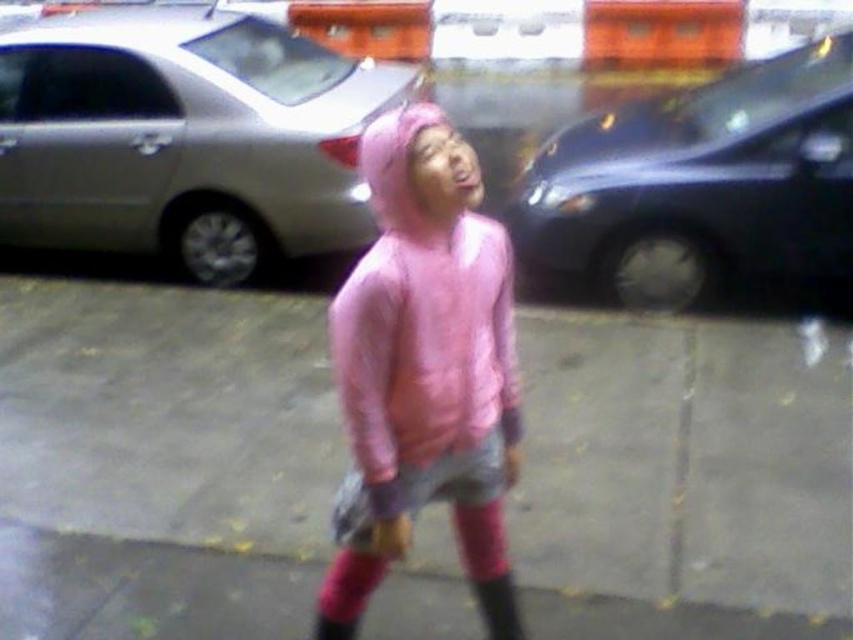
Question: Is the position of silver metallic sedan at center more distant than that of pink rubber rain boot at center?

Choices:
 (A) yes
 (B) no

Answer: (A)

Question: Does shiny black car at right have a smaller size compared to pink rubber rain boot at center?

Choices:
 (A) yes
 (B) no

Answer: (B)

Question: Which object is positioned farthest from the shiny black car at right?

Choices:
 (A) pink matte hoodie at center
 (B) pink rubber rain boot at center
 (C) gray concrete pavement at center

Answer: (B)

Question: Which object is the farthest from the pink matte hoodie at center?

Choices:
 (A) silver metallic sedan at center
 (B) gray concrete pavement at center

Answer: (A)

Question: Among these objects, which one is nearest to the camera?

Choices:
 (A) silver metallic sedan at center
 (B) gray concrete pavement at center
 (C) pink matte hoodie at center
 (D) pink rubber rain boot at center

Answer: (C)

Question: Does gray concrete pavement at center appear on the right side of pink rubber rain boot at center?

Choices:
 (A) yes
 (B) no

Answer: (B)